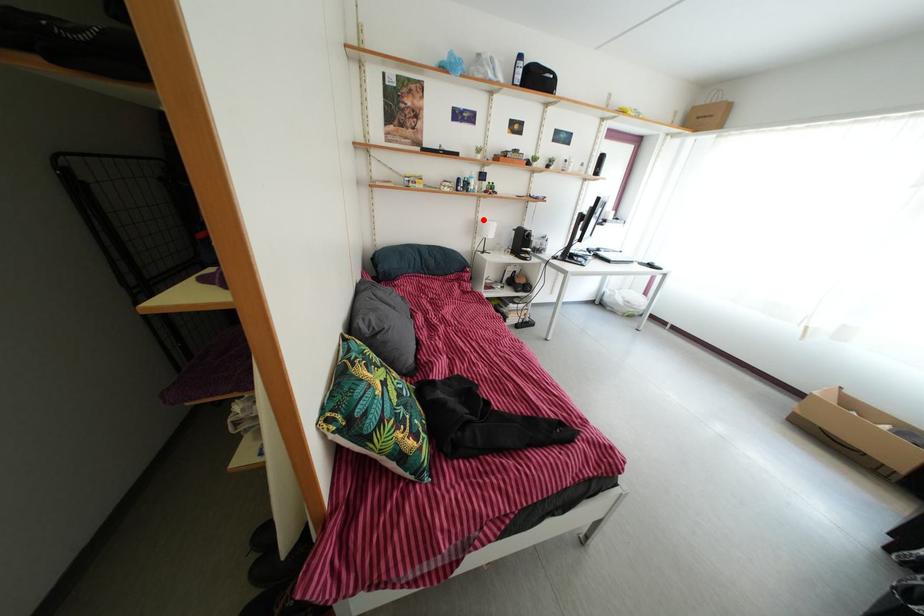
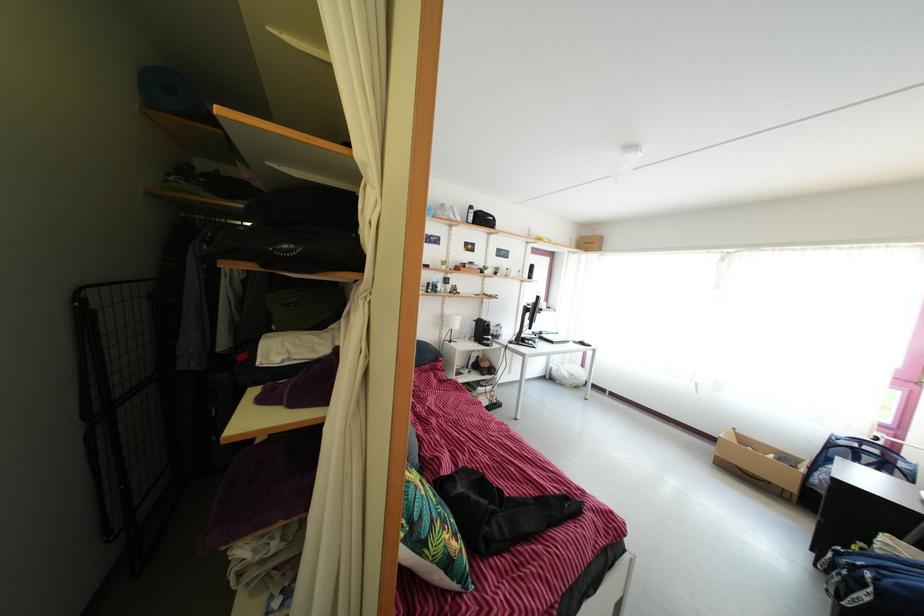
Question: I am providing you with two images of the same scene from different viewpoints. A red point is shown in image1. For the corresponding object point in image2, is it positioned nearer or farther from the camera?

Choices:
 (A) Nearer
 (B) Farther

Answer: (B)